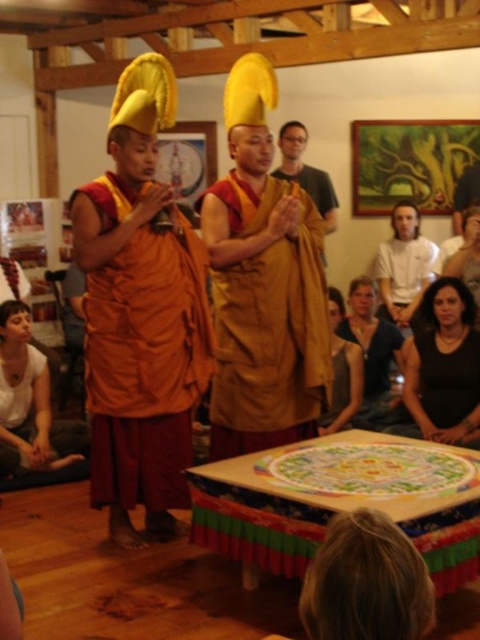
Question: Is orange clothed monk at left wider than golden robe monk at center?

Choices:
 (A) no
 (B) yes

Answer: (B)

Question: Which of the following is the closest to the observer?

Choices:
 (A) (231, 282)
 (B) (277, 173)
 (C) (93, 394)

Answer: (C)

Question: Which object is farther from the camera taking this photo?

Choices:
 (A) smooth brown leather jacket at lower right
 (B) matte gold robe at center
 (C) orange clothed monk at left

Answer: (A)

Question: Is orange clothed monk at left wider than matte gold robe at center?

Choices:
 (A) yes
 (B) no

Answer: (B)

Question: Considering the real-world distances, which object is farthest from the smooth brown leather jacket at lower right?

Choices:
 (A) matte gold robe at center
 (B) orange clothed monk at left

Answer: (B)

Question: Does matte gold robe at center have a smaller size compared to smooth brown leather jacket at lower right?

Choices:
 (A) no
 (B) yes

Answer: (A)